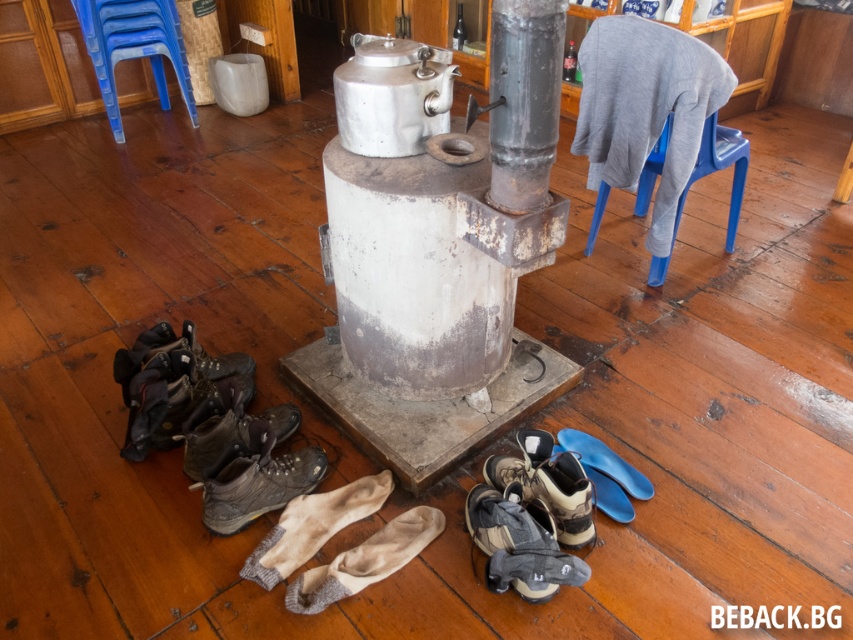
Question: Does light brown suede socks at center have a larger size compared to blue rubber shoe at lower center?

Choices:
 (A) no
 (B) yes

Answer: (B)

Question: Estimate the real-world distances between objects in this image. Which object is closer to the leather/textured shoe at lower center?

Choices:
 (A) leather hiking boot at lower left
 (B) leather/rough hiking boot at lower center
 (C) blue plastic stool at upper left

Answer: (B)

Question: Is blue plastic stool at upper left above leather/rough hiking boot at lower center?

Choices:
 (A) yes
 (B) no

Answer: (A)

Question: Observing the image, what is the correct spatial positioning of blue plastic stool at upper left in reference to light brown suede socks at center?

Choices:
 (A) left
 (B) right

Answer: (A)

Question: Which of the following is the closest to the observer?

Choices:
 (A) (538, 3)
 (B) (524, 458)
 (C) (619, 472)

Answer: (A)

Question: Which is farther from the leather/textured shoe at lower center?

Choices:
 (A) brown suede shoes at lower center
 (B) gray fabric-covered stool at upper right
 (C) leather hiking boot at lower left
 (D) metallic gray pillar at center

Answer: (B)